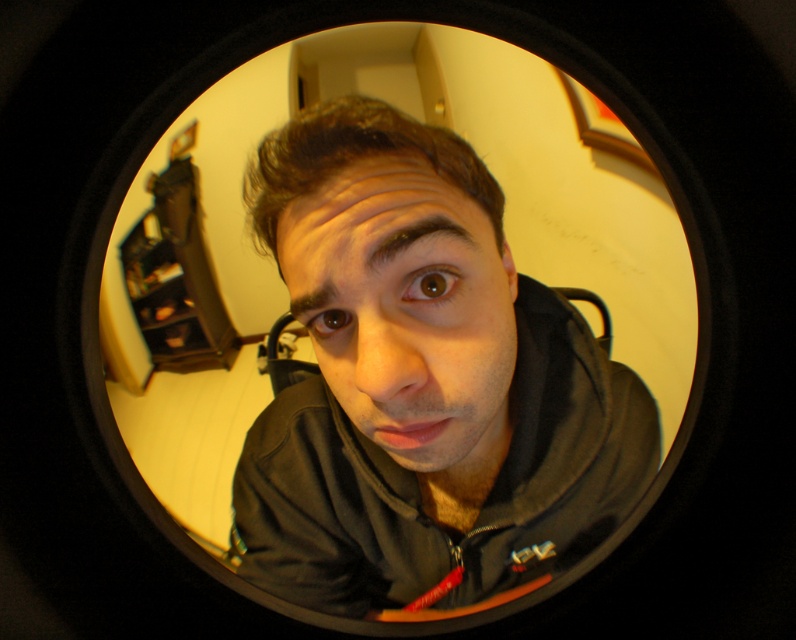
You are designing a poster and need to ensure the matte black hoodie at center and the smooth skin face at center are proportionally accurate. Based on the image, which object should be depicted as taller in the poster?

The matte black hoodie at center should be depicted as taller in the poster since it has a greater height compared to the smooth skin face at center according to the description.

You are a photographer trying to adjust the lighting for a portrait. You notice the matte black hoodie at center and the smooth skin face at center in your frame. Which object is positioned lower in the image?

The matte black hoodie at center is below the smooth skin face at center, so it is positioned lower in the image.

You are standing in a room with a circular fisheye view. You see a point at coordinates (x=420, y=381). What object is located at that point?

The point at coordinates (x=420, y=381) has the matte black hoodie at center.